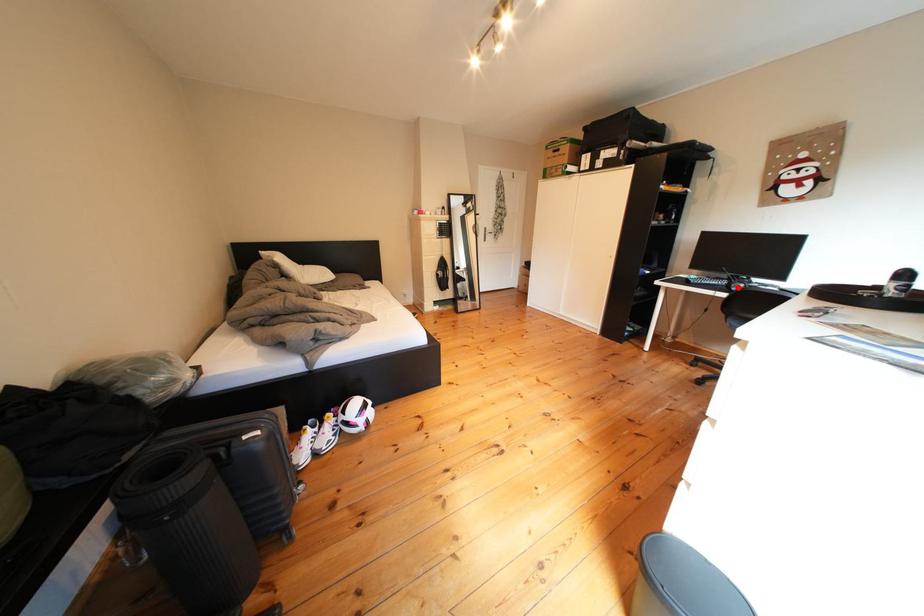
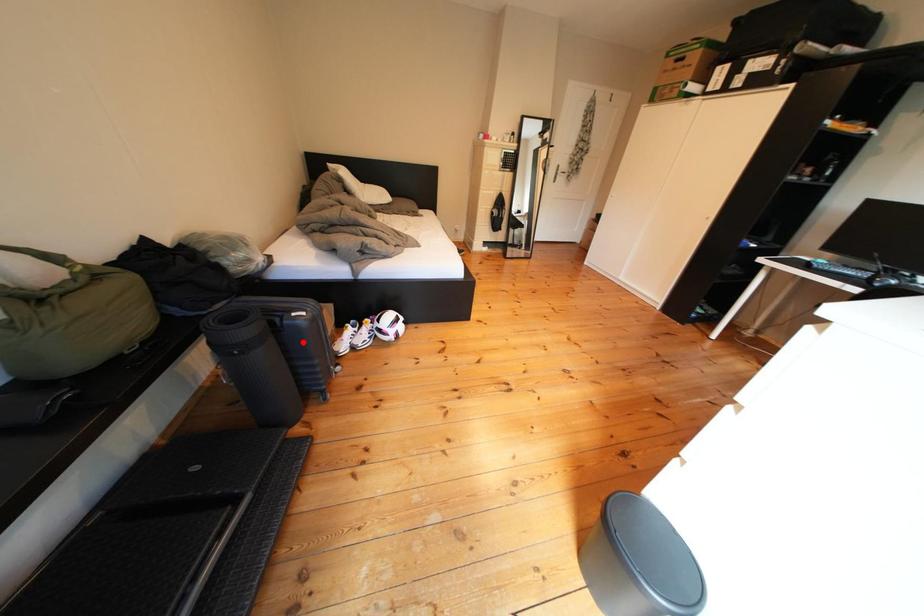
I am providing you with two images of the same scene from different viewpoints. A red point is marked on the first image and another point is marked on the second image. Do the highlighted points in image1 and image2 indicate the same real-world spot?

No